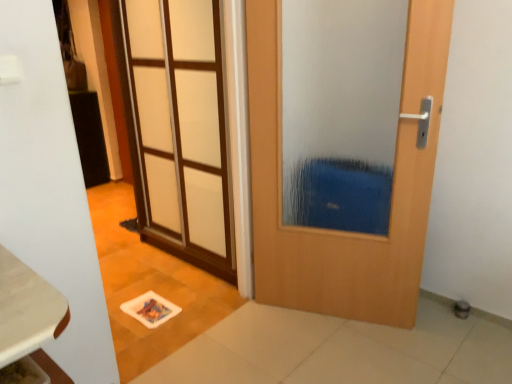
The image size is (512, 384). I want to click on vacant space positioned to the left of wooden door at center, which is counted as the first door, starting from the right, so click(260, 338).